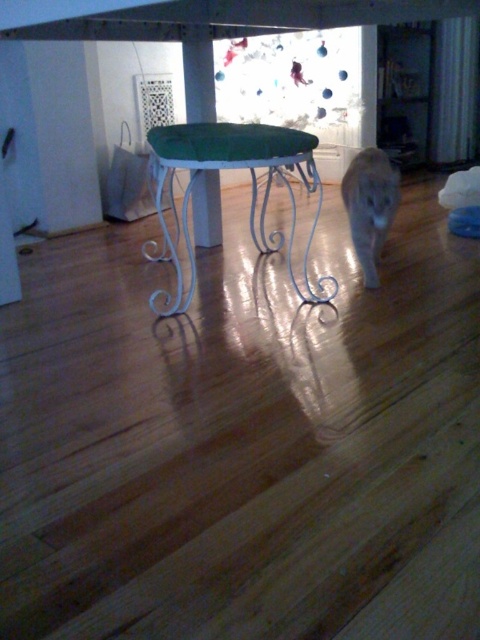
Question: Can you confirm if white wrought iron table at center is positioned to the right of gray fur cat at center?

Choices:
 (A) yes
 (B) no

Answer: (B)

Question: Which of the following is the farthest from the observer?

Choices:
 (A) white wrought iron table at center
 (B) gray fur cat at center

Answer: (B)

Question: Considering the relative positions of white wrought iron table at center and gray fur cat at center in the image provided, where is white wrought iron table at center located with respect to gray fur cat at center?

Choices:
 (A) left
 (B) right

Answer: (A)

Question: Can you confirm if white wrought iron table at center is positioned below gray fur cat at center?

Choices:
 (A) yes
 (B) no

Answer: (A)